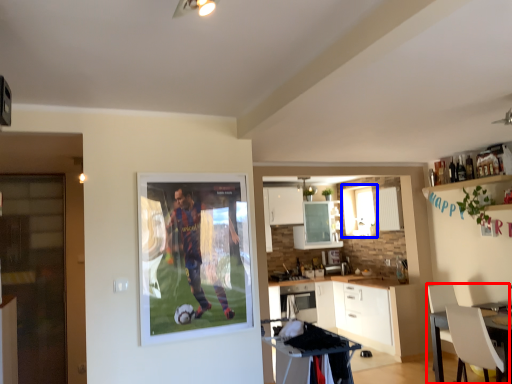
Question: Which point is further to the camera, chair (highlighted by a red box) or window (highlighted by a blue box)?

Choices:
 (A) chair
 (B) window

Answer: (B)